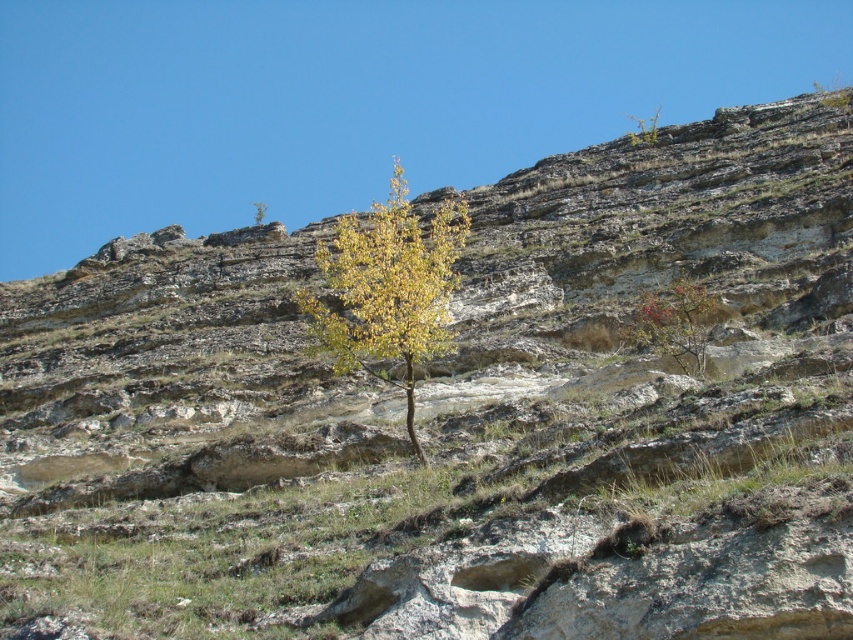
Between yellow-green foliage at center and reddish-brown bark tree at right, which one is positioned lower?

reddish-brown bark tree at right is below.

In order to click on yellow-green foliage at center in this screenshot , I will do pos(387,291).

Between point (358, 221) and point (643, 307), which one is positioned behind?

Positioned behind is point (358, 221).

Find the location of `yellow-green foliage at center`. yellow-green foliage at center is located at coordinates pyautogui.click(x=387, y=291).